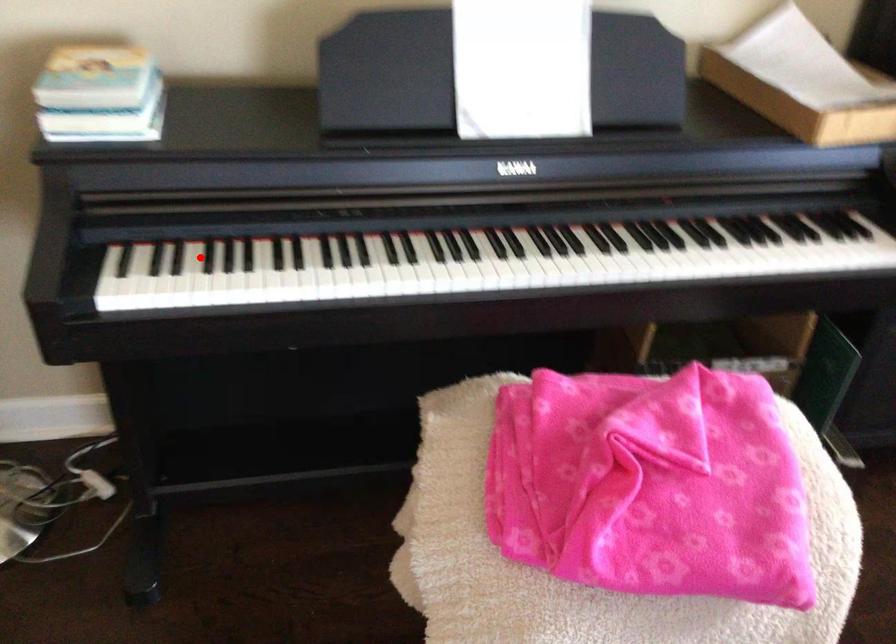
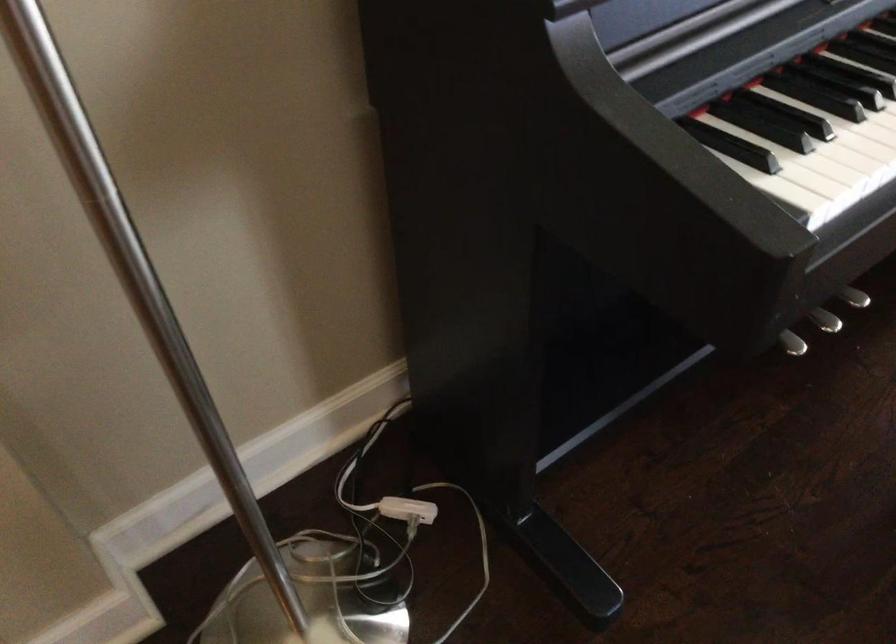
Find the pixel in the second image that matches the highlighted location in the first image.

(799, 100)